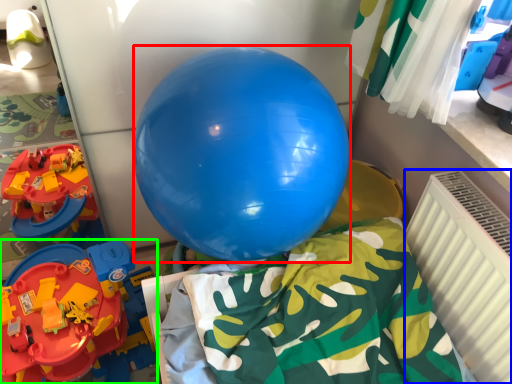
Question: Considering the real-world distances, which object is farthest from balloon (highlighted by a red box)? radiator (highlighted by a blue box) or toy (highlighted by a green box)?

Choices:
 (A) radiator
 (B) toy

Answer: (B)